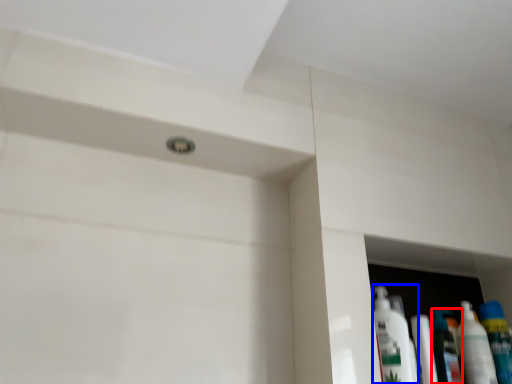
Question: Among these objects, which one is nearest to the camera, mouthwash (highlighted by a red box) or cleaning product (highlighted by a blue box)?

Choices:
 (A) mouthwash
 (B) cleaning product

Answer: (B)